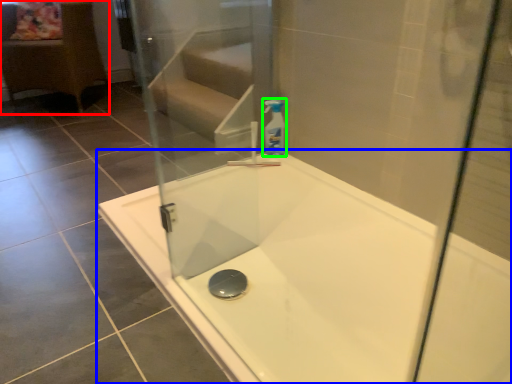
Question: Estimate the real-world distances between objects in this image. Which object is farther from furniture (highlighted by a red box), bathtub (highlighted by a blue box) or cleaning product (highlighted by a green box)?

Choices:
 (A) bathtub
 (B) cleaning product

Answer: (A)